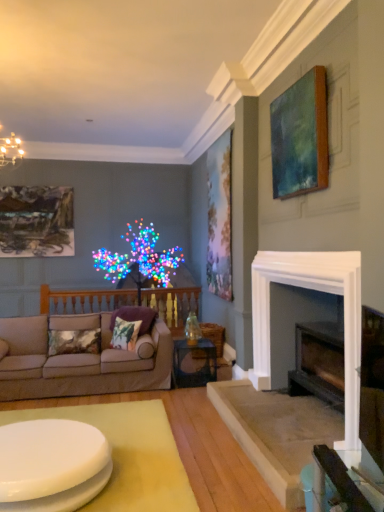
Question: Relative to textured velvet pillow at lower left, arranged as the 3th pillow when viewed from the right, is matte green painting at upper right, which appears as the second picture frame when viewed from the back, in front or behind?

Choices:
 (A) front
 (B) behind

Answer: (B)

Question: Is matte green painting at upper right, marked as the 2th picture frame in a front-to-back arrangement, wider or thinner than textured velvet pillow at lower left, arranged as the 3th pillow when viewed from the right?

Choices:
 (A) thin
 (B) wide

Answer: (A)

Question: Estimate the real-world distances between objects in this image. Which object is farther from the greenish-blue canvas at upper right, which is the third picture frame in back-to-front order?

Choices:
 (A) oil painting at upper left, arranged as the first picture frame when viewed from the back
 (B) green printed fabric pillow at center, which is the second pillow in right-to-left order
 (C) white glossy coffee table at center
 (D) textured velvet pillow at lower left, arranged as the 3th pillow when viewed from the right
 (E) purple velvet pillow at center, the 3th pillow viewed from the left

Answer: (A)

Question: Considering the real-world distances, which object is closest to the beige fabric couch at left?

Choices:
 (A) green printed fabric pillow at center, which is the second pillow in right-to-left order
 (B) greenish-blue canvas at upper right, which is the 3th picture frame in left-to-right order
 (C) clear glass table at center
 (D) oil painting at upper left, arranged as the first picture frame when viewed from the back
 (E) textured velvet pillow at lower left, arranged as the 3th pillow when viewed from the right

Answer: (E)